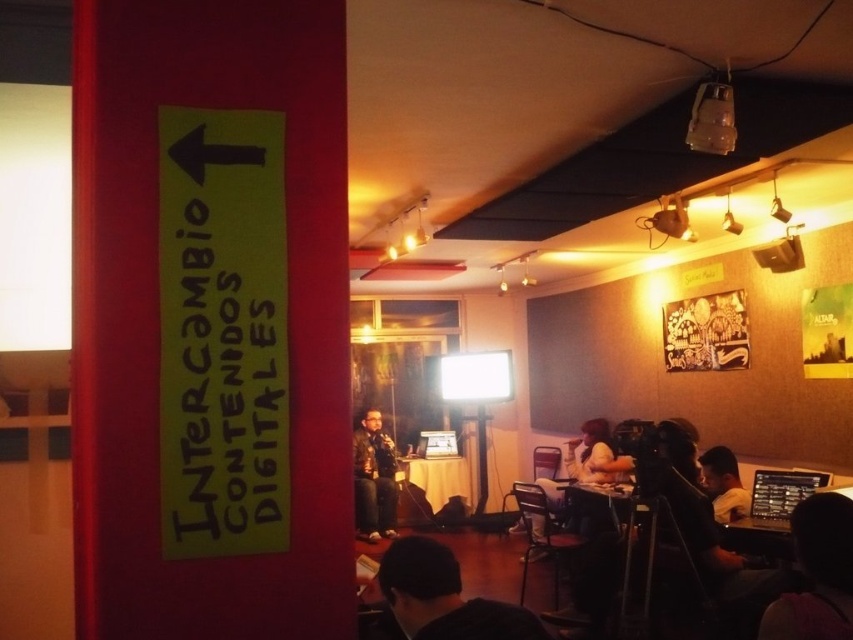
Can you confirm if silhouette of person at lower right is positioned above light brown leather jacket at lower right?

Correct, silhouette of person at lower right is located above light brown leather jacket at lower right.

Between silhouette of person at lower right and light brown leather jacket at lower right, which one appears on the right side from the viewer's perspective?

Positioned to the right is light brown leather jacket at lower right.

Where is `silhouette of person at lower right`? silhouette of person at lower right is located at coordinates (817, 573).

Between black leather jacket at lower center and leather jacket at center, which one appears on the right side from the viewer's perspective?

Positioned to the right is black leather jacket at lower center.

At what (x,y) coordinates should I click in order to perform the action: click on black leather jacket at lower center. Please return your answer as a coordinate pair (x, y). Looking at the image, I should click on (444, 596).

Locate an element on the screen. The width and height of the screenshot is (853, 640). black leather jacket at lower center is located at coordinates (444, 596).

Can you confirm if leather jacket at center is bigger than light brown leather jacket at lower right?

Indeed, leather jacket at center has a larger size compared to light brown leather jacket at lower right.

Who is more distant from viewer, (x=384, y=529) or (x=729, y=497)?

Point (x=384, y=529)

Which is in front, point (358, 493) or point (732, 492)?

Point (732, 492) is more forward.

The image size is (853, 640). Identify the location of leather jacket at center. (373, 477).